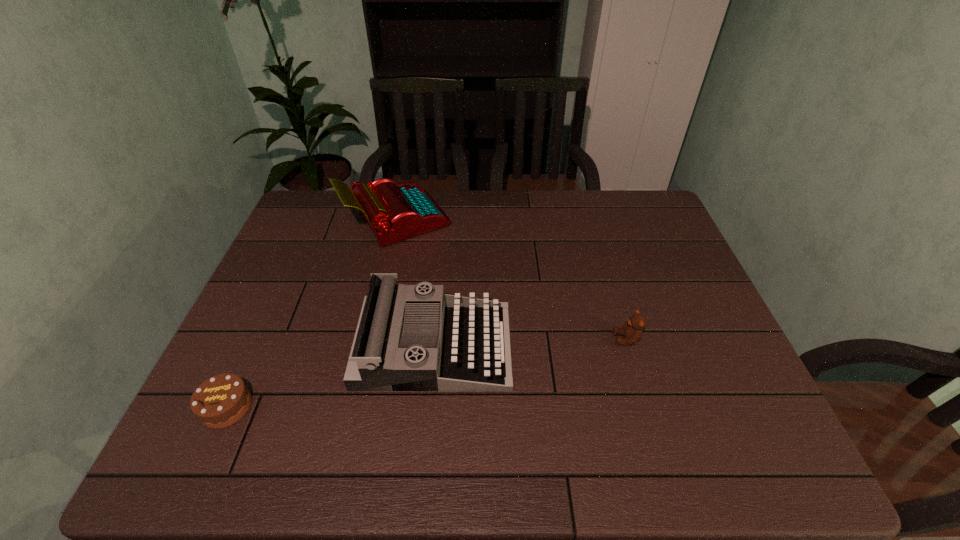
This screenshot has width=960, height=540. I want to click on unoccupied area between the chocolate cake and the tallest object, so click(x=312, y=313).

Identify the location of object that is the third closest to the second tallest object. The image size is (960, 540). (632, 330).

Find the location of a particular element. The height and width of the screenshot is (540, 960). object that stands as the third closest to the tallest object is located at coordinates (632, 330).

Image resolution: width=960 pixels, height=540 pixels. Identify the location of free point that satisfies the following two spatial constraints: 1. on the typing side of the third shortest object; 2. on the front side of the leftmost object. (428, 407).

Locate an element on the screen. The image size is (960, 540). blank space that satisfies the following two spatial constraints: 1. on the typing side of the farthest object; 2. on the front side of the leftmost object is located at coordinates (354, 407).